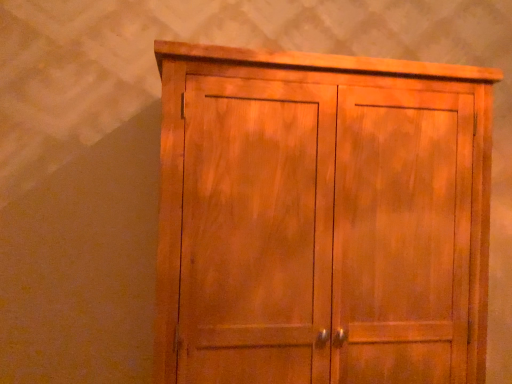
The image size is (512, 384). What are the coordinates of `wooden cabinet at center` in the screenshot? It's located at (321, 219).

The height and width of the screenshot is (384, 512). What do you see at coordinates (321, 219) in the screenshot?
I see `wooden cabinet at center` at bounding box center [321, 219].

Measure the distance between point (273,182) and camera.

The distance of point (273,182) from camera is 3.83 feet.

Identify the location of wooden cabinet at center. The image size is (512, 384). coord(321,219).